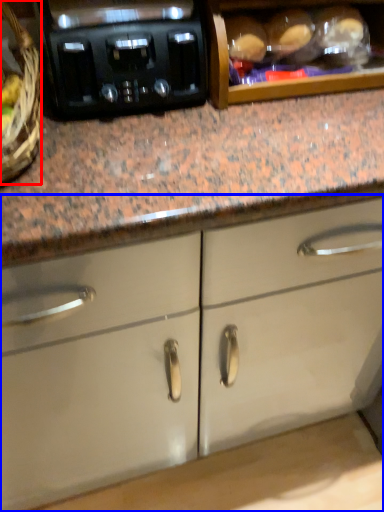
Question: Which of the following is the farthest to the observer, basket (highlighted by a red box) or cabinetry (highlighted by a blue box)?

Choices:
 (A) basket
 (B) cabinetry

Answer: (B)